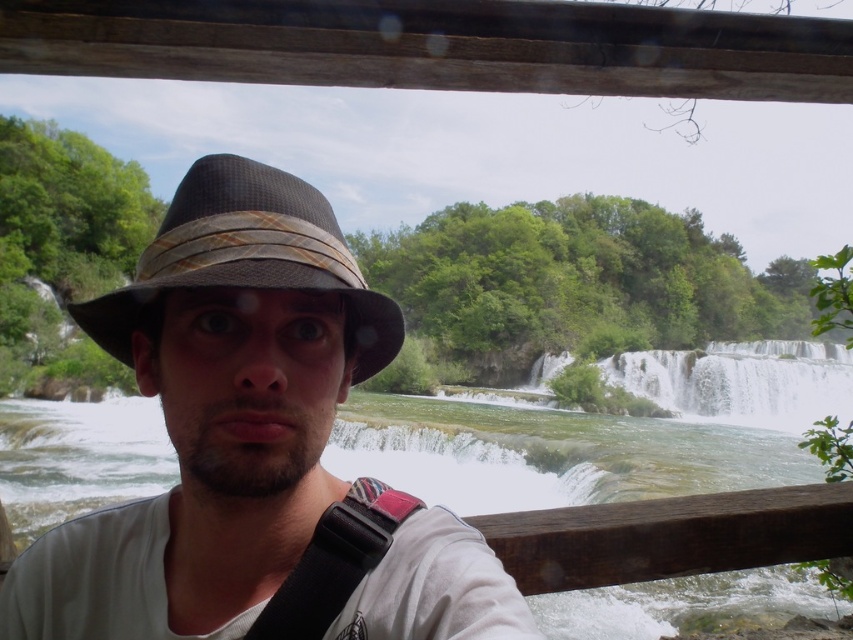
You are a photographer standing at the camera position in the scene. You want to capture a closeup shot of the matte brown hat at center without moving the man. Can you achieve this using a standard zoom lens with a maximum focal length of 200mm? Assume the hat is 1.71 meters from the camera.

The matte brown hat at center is 1.71 meters from the camera. A standard zoom lens with a maximum focal length of 200mm can achieve closeup shots from this distance, so yes, you can capture the closeup without moving the man.

You are a photographer trying to capture a closeup of both the textured brown fedora at center and the black leather strap at center in the image. What is the minimum distance you need to maintain between the camera and the subject to ensure both are in frame?

To capture both the textured brown fedora at center and the black leather strap at center in the same frame, the minimum distance required is 1.50 meters, as they are positioned 1.50 meters apart from each other.